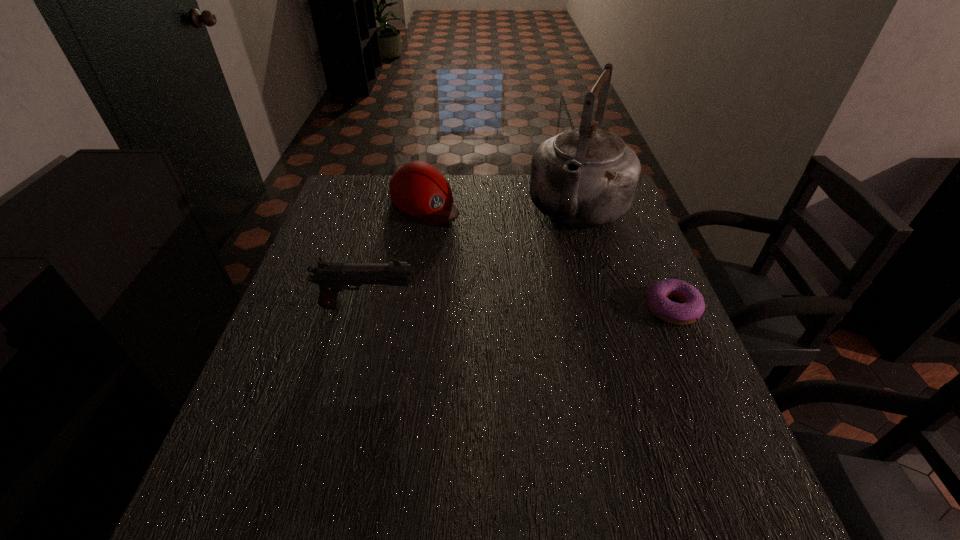
Identify the location of vacant space located at the spout of the kettle. (x=522, y=353).

Where is `free space located 0.370m at the spout of the kettle`? free space located 0.370m at the spout of the kettle is located at coordinates (526, 342).

You are a GUI agent. You are given a task and a screenshot of the screen. Output one action in this format:
    pyautogui.click(x=<x>, y=<y>)
    Task: Click on the baseball cap situated at the far edge
    The width and height of the screenshot is (960, 540).
    Given the screenshot: What is the action you would take?
    pyautogui.click(x=418, y=189)

Where is `kettle present at the far edge`? kettle present at the far edge is located at coordinates (586, 176).

Locate an element on the screen. This screenshot has width=960, height=540. object that is at the left edge is located at coordinates (332, 277).

Image resolution: width=960 pixels, height=540 pixels. What are the coordinates of `doughnut at the right edge` in the screenshot? It's located at (692, 306).

Identify the location of kettle that is positioned at the right edge. (586, 176).

Identify the location of object that is at the far right corner. The image size is (960, 540). (586, 176).

I want to click on vacant region at the far edge of the desktop, so click(388, 213).

The image size is (960, 540). I want to click on free location at the near edge of the desktop, so click(408, 447).